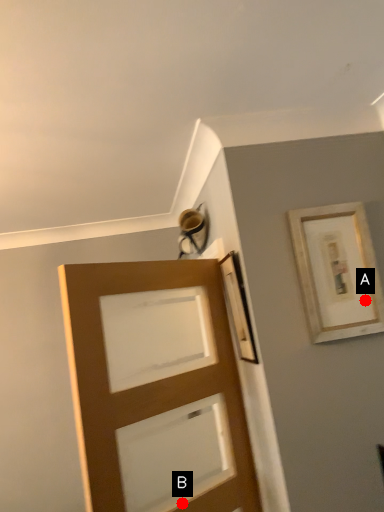
Question: Two points are circled on the image, labeled by A and B beside each circle. Which point is farther from the camera taking this photo?

Choices:
 (A) A is further
 (B) B is further

Answer: (A)